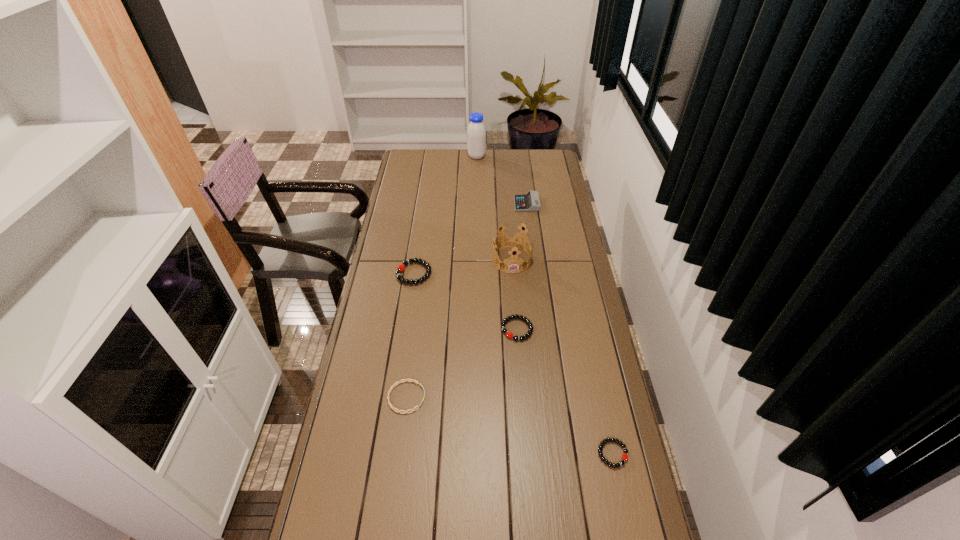
Identify the location of blue bracelet. The height and width of the screenshot is (540, 960). (398, 382).

This screenshot has height=540, width=960. Find the location of `the rightmost black bracelet`. the rightmost black bracelet is located at coordinates (624, 458).

At what (x,y) coordinates should I click in order to perform the action: click on the smallest black bracelet. Please return your answer as a coordinate pair (x, y). Looking at the image, I should click on (624, 458).

Where is `free space located on the right of the soya milk`? This screenshot has width=960, height=540. free space located on the right of the soya milk is located at coordinates (515, 157).

Find the location of a particular element. free space located 0.340m on the left of the crown is located at coordinates (412, 260).

Find the location of a particular element. The height and width of the screenshot is (540, 960). vacant space located 0.060m on the left of the sixth nearest object is located at coordinates (502, 204).

Locate an element on the screen. This screenshot has height=540, width=960. vacant space located on the right of the biggest black bracelet is located at coordinates (520, 273).

This screenshot has width=960, height=540. I want to click on free location located on the right of the third nearest object, so click(x=583, y=329).

The width and height of the screenshot is (960, 540). I want to click on vacant space situated 0.400m on the surface of the third farthest bracelet showing star-shaped elements, so click(551, 397).

Where is `free space located 0.330m on the left of the nearest bracelet`? This screenshot has width=960, height=540. free space located 0.330m on the left of the nearest bracelet is located at coordinates (483, 454).